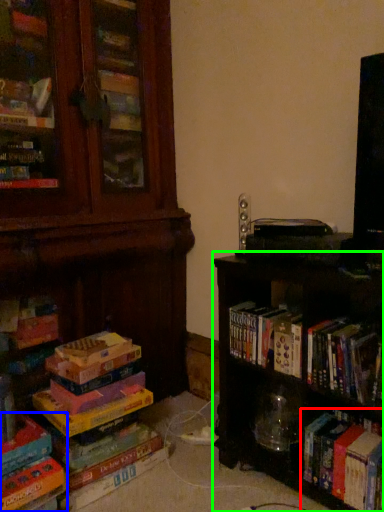
Question: Considering the real-world distances, which object is closest to book (highlighted by a red box)? book (highlighted by a blue box) or shelf (highlighted by a green box).

Choices:
 (A) book
 (B) shelf

Answer: (B)